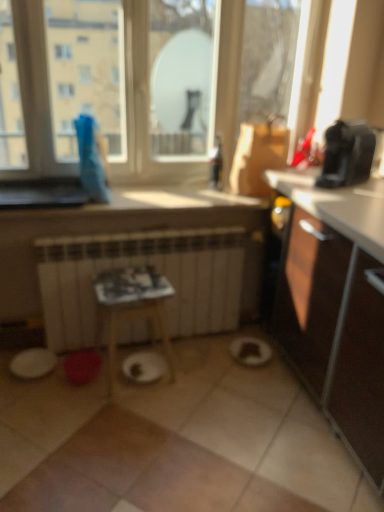
Question: Can you confirm if transparent glass window at upper center is positioned to the left of white matte paper plate at center?

Choices:
 (A) yes
 (B) no

Answer: (B)

Question: Is transparent glass window at upper center positioned behind white matte paper plate at center?

Choices:
 (A) yes
 (B) no

Answer: (B)

Question: From a real-world perspective, is transparent glass window at upper center positioned under white matte paper plate at center based on gravity?

Choices:
 (A) no
 (B) yes

Answer: (A)

Question: Does transparent glass window at upper center have a greater height compared to white matte paper plate at center?

Choices:
 (A) no
 (B) yes

Answer: (B)

Question: Considering the relative sizes of transparent glass window at upper center and white matte paper plate at center in the image provided, is transparent glass window at upper center shorter than white matte paper plate at center?

Choices:
 (A) no
 (B) yes

Answer: (A)

Question: Considering the positions of white matte paper plate at center and transparent glass window at upper center in the image, is white matte paper plate at center bigger or smaller than transparent glass window at upper center?

Choices:
 (A) big
 (B) small

Answer: (B)

Question: In the image, is white matte paper plate at center positioned in front of or behind transparent glass window at upper center?

Choices:
 (A) front
 (B) behind

Answer: (B)

Question: From the image's perspective, is white matte paper plate at center above or below transparent glass window at upper center?

Choices:
 (A) below
 (B) above

Answer: (A)

Question: Considering the positions of point (160, 357) and point (59, 6), is point (160, 357) closer or farther from the camera than point (59, 6)?

Choices:
 (A) farther
 (B) closer

Answer: (A)

Question: Visually, is wooden table at center positioned to the left or to the right of black plastic coffee maker at upper right?

Choices:
 (A) right
 (B) left

Answer: (B)

Question: From the image's perspective, is wooden table at center located above or below black plastic coffee maker at upper right?

Choices:
 (A) above
 (B) below

Answer: (B)

Question: Which is correct: wooden table at center is inside black plastic coffee maker at upper right, or outside of it?

Choices:
 (A) inside
 (B) outside

Answer: (B)

Question: In terms of height, does wooden table at center look taller or shorter compared to black plastic coffee maker at upper right?

Choices:
 (A) tall
 (B) short

Answer: (A)

Question: From a real-world perspective, relative to black plastic coffee maker at upper right, is transparent glass window at upper center vertically above or below?

Choices:
 (A) below
 (B) above

Answer: (B)

Question: Is transparent glass window at upper center taller or shorter than black plastic coffee maker at upper right?

Choices:
 (A) short
 (B) tall

Answer: (B)